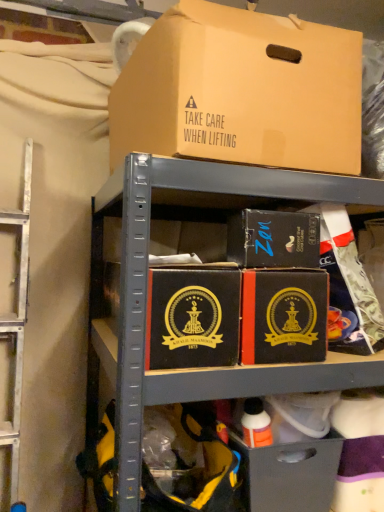
Question: Which direction should I rotate to look at brown cardboard box at upper center, placed as the 3th box when sorted from bottom to top, — up or down?

Choices:
 (A) down
 (B) up

Answer: (B)

Question: From the image's perspective, is matte black box at center, which is the 2th box from bottom to top, on black matte box at center, which is the 3th box in top-to-bottom order?

Choices:
 (A) no
 (B) yes

Answer: (B)

Question: Can you confirm if matte black box at center, which is the 2th box from bottom to top, is smaller than black matte box at center, which is the 3th box in top-to-bottom order?

Choices:
 (A) yes
 (B) no

Answer: (A)

Question: Is matte black box at center, which is the 2th box from bottom to top, facing towards black matte box at center, the 1th box from the bottom?

Choices:
 (A) yes
 (B) no

Answer: (B)

Question: Is matte black box at center, placed as the 2th box when sorted from top to bottom, facing away from black matte box at center, the 1th box from the bottom?

Choices:
 (A) no
 (B) yes

Answer: (A)

Question: From a real-world perspective, does matte black box at center, placed as the 2th box when sorted from top to bottom, sit lower than black matte box at center, the 1th box from the bottom?

Choices:
 (A) yes
 (B) no

Answer: (B)

Question: Is matte black box at center, placed as the 2th box when sorted from top to bottom, bigger than black matte box at center, which is the 3th box in top-to-bottom order?

Choices:
 (A) yes
 (B) no

Answer: (B)

Question: Is black matte box at center, which is the 3th box in top-to-bottom order, facing away from matte black drawer at lower center?

Choices:
 (A) no
 (B) yes

Answer: (A)

Question: Is there a large distance between black matte box at center, the 1th box from the bottom, and matte black drawer at lower center?

Choices:
 (A) yes
 (B) no

Answer: (B)

Question: Is black matte box at center, which is the 3th box in top-to-bottom order, thinner than matte black drawer at lower center?

Choices:
 (A) yes
 (B) no

Answer: (B)

Question: Is the depth of black matte box at center, which is the 3th box in top-to-bottom order, less than that of matte black drawer at lower center?

Choices:
 (A) yes
 (B) no

Answer: (A)

Question: Is black matte box at center, the 1th box from the bottom, at the left side of matte black drawer at lower center?

Choices:
 (A) yes
 (B) no

Answer: (A)

Question: Considering the relative sizes of black matte box at center, which is the 3th box in top-to-bottom order, and matte black drawer at lower center in the image provided, is black matte box at center, which is the 3th box in top-to-bottom order, wider than matte black drawer at lower center?

Choices:
 (A) no
 (B) yes

Answer: (B)

Question: Is brown cardboard box at upper center, placed as the 3th box when sorted from bottom to top, not inside matte black box at center, placed as the 2th box when sorted from top to bottom?

Choices:
 (A) yes
 (B) no

Answer: (A)